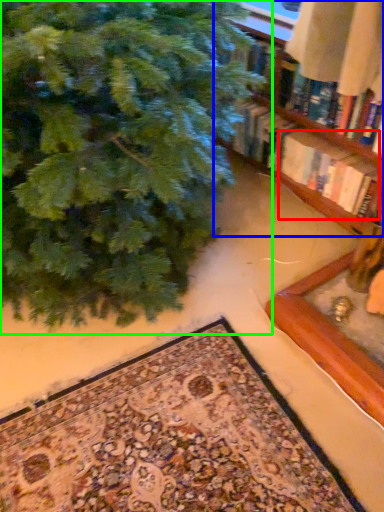
Question: Estimate the real-world distances between objects in this image. Which object is closer to book (highlighted by a red box), shelf (highlighted by a blue box) or christmas tree (highlighted by a green box)?

Choices:
 (A) shelf
 (B) christmas tree

Answer: (A)